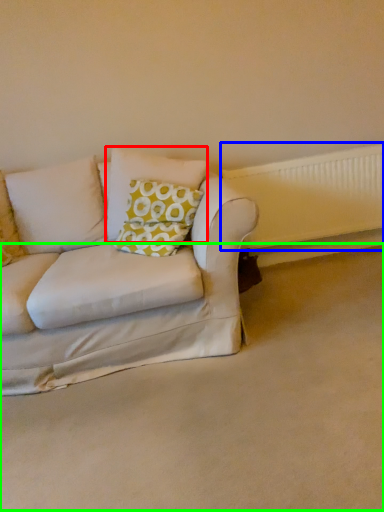
Question: Which object is positioned closest to pillow (highlighted by a red box)? Select from radiator (highlighted by a blue box) and plain (highlighted by a green box).

Choices:
 (A) radiator
 (B) plain

Answer: (A)